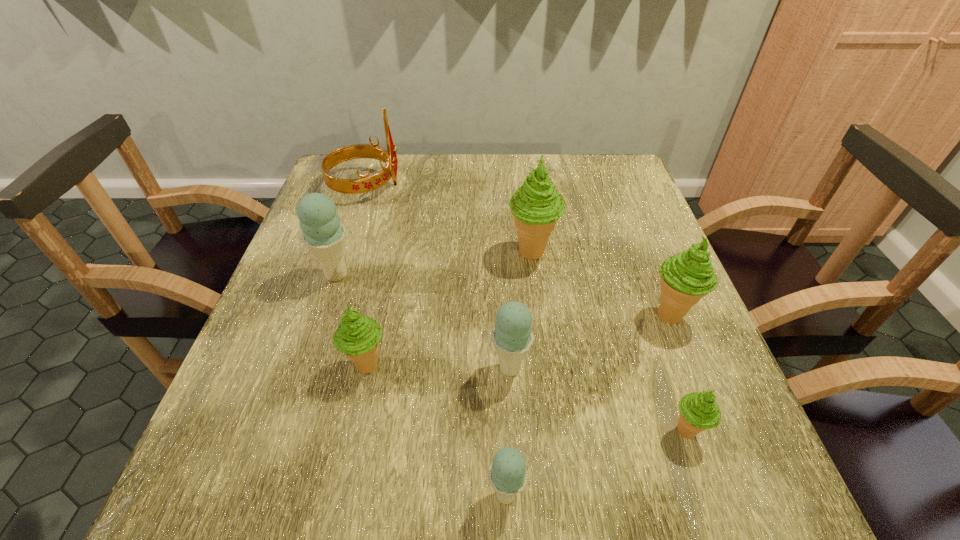
Where is `free region located 0.200m on the front of the leftmost green icecream`? This screenshot has height=540, width=960. free region located 0.200m on the front of the leftmost green icecream is located at coordinates (337, 504).

Where is `free space located 0.160m on the back of the smallest green icecream`? free space located 0.160m on the back of the smallest green icecream is located at coordinates coord(654,339).

Locate an element on the screen. This screenshot has width=960, height=540. vacant space located 0.090m on the left of the smallest blue ice cream is located at coordinates (427, 494).

Find the location of a particular element. Image resolution: width=960 pixels, height=540 pixels. object situated at the far edge is located at coordinates (365, 183).

Where is `object present at the near edge`? This screenshot has width=960, height=540. object present at the near edge is located at coordinates (508, 475).

I want to click on tiara that is at the left edge, so click(365, 183).

Identify the location of ice cream that is at the left edge. This screenshot has width=960, height=540. 324,235.

Locate an element on the screen. object present at the far left corner is located at coordinates (365, 183).

In the image, there is a desktop. In order to click on vacant space at the far edge in this screenshot , I will do `click(468, 158)`.

Locate an element on the screen. The width and height of the screenshot is (960, 540). vacant space at the near edge of the desktop is located at coordinates (446, 460).